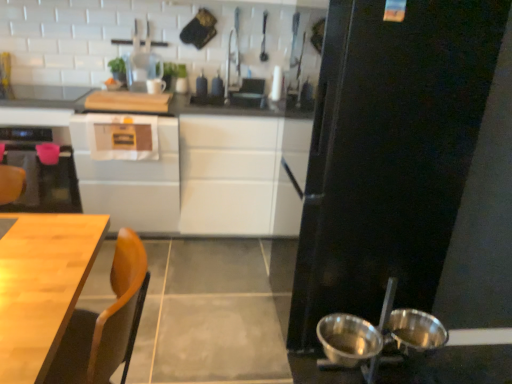
Question: Does wooden table at lower left appear on the right side of white glossy cabinet at center, positioned as the second cabinetry in left-to-right order?

Choices:
 (A) yes
 (B) no

Answer: (A)

Question: Is wooden table at lower left behind white glossy cabinet at center, positioned as the second cabinetry in left-to-right order?

Choices:
 (A) yes
 (B) no

Answer: (B)

Question: Considering the relative sizes of wooden table at lower left and white glossy cabinet at center, positioned as the second cabinetry in left-to-right order, in the image provided, is wooden table at lower left thinner than white glossy cabinet at center, positioned as the second cabinetry in left-to-right order,?

Choices:
 (A) no
 (B) yes

Answer: (B)

Question: Are wooden table at lower left and white glossy cabinet at center, positioned as the second cabinetry in left-to-right order, making contact?

Choices:
 (A) yes
 (B) no

Answer: (B)

Question: Is white glossy cabinet at center, placed as the first cabinetry when sorted from right to left, at the back of wooden table at lower left?

Choices:
 (A) yes
 (B) no

Answer: (B)

Question: From a real-world perspective, is wooden table at lower left located higher than white glossy cabinet at center, placed as the first cabinetry when sorted from right to left?

Choices:
 (A) no
 (B) yes

Answer: (A)

Question: Is white glossy cabinet at center, placed as the first cabinetry when sorted from right to left, bigger than metallic silver bowl at lower right, which appears as the 1th bowl when viewed from the left?

Choices:
 (A) yes
 (B) no

Answer: (A)

Question: Is metallic silver bowl at lower right, the second bowl when ordered from right to left, at the back of white glossy cabinet at center, positioned as the second cabinetry in left-to-right order?

Choices:
 (A) no
 (B) yes

Answer: (A)

Question: Is white glossy cabinet at center, placed as the first cabinetry when sorted from right to left, wider than metallic silver bowl at lower right, which appears as the 1th bowl when viewed from the left?

Choices:
 (A) no
 (B) yes

Answer: (B)

Question: Is white glossy cabinet at center, placed as the first cabinetry when sorted from right to left, shorter than metallic silver bowl at lower right, the second bowl when ordered from right to left?

Choices:
 (A) no
 (B) yes

Answer: (A)

Question: Can you confirm if white glossy cabinet at center, placed as the first cabinetry when sorted from right to left, is taller than metallic silver bowl at lower right, which appears as the 1th bowl when viewed from the left?

Choices:
 (A) no
 (B) yes

Answer: (B)

Question: Is white glossy cabinet at center, positioned as the second cabinetry in left-to-right order, positioned in front of metallic silver bowl at lower right, which appears as the 1th bowl when viewed from the left?

Choices:
 (A) no
 (B) yes

Answer: (A)

Question: Is black matte refrigerator at right looking in the opposite direction of shiny metallic bowls at lower right, the first bowl in the right-to-left sequence?

Choices:
 (A) yes
 (B) no

Answer: (B)